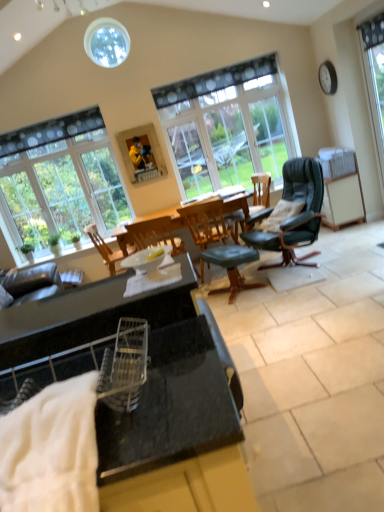
Question: Can you confirm if clear glass window at upper left, the third window in the front-to-back sequence, is thinner than clear glass window at right, which appears as the first window when viewed from the right?

Choices:
 (A) no
 (B) yes

Answer: (A)

Question: Does clear glass window at upper left, which ranks as the 3th window in right-to-left order, turn towards clear glass window at right, acting as the first window starting from the front?

Choices:
 (A) yes
 (B) no

Answer: (B)

Question: From a real-world perspective, is clear glass window at upper left, which ranks as the 3th window in right-to-left order, on top of clear glass window at right, the 3th window positioned from the left?

Choices:
 (A) no
 (B) yes

Answer: (B)

Question: Is clear glass window at right, which appears as the first window when viewed from the right, located within clear glass window at upper left, positioned as the 1th window in back-to-front order?

Choices:
 (A) no
 (B) yes

Answer: (A)

Question: From the image's perspective, would you say clear glass window at upper left, which ranks as the 3th window in right-to-left order, is positioned over clear glass window at right, which appears as the first window when viewed from the right?

Choices:
 (A) yes
 (B) no

Answer: (B)

Question: Is clear glass window at upper left, marked as the first window in a left-to-right arrangement, in contact with clear glass window at right, acting as the first window starting from the front?

Choices:
 (A) yes
 (B) no

Answer: (B)

Question: Could you tell me if black granite cabinet at center is turned towards green leafy plant at left?

Choices:
 (A) yes
 (B) no

Answer: (B)

Question: Does black granite cabinet at center appear on the right side of green leafy plant at left?

Choices:
 (A) no
 (B) yes

Answer: (B)

Question: Is green leafy plant at left at the back of black granite cabinet at center?

Choices:
 (A) yes
 (B) no

Answer: (A)

Question: Is green leafy plant at left inside black granite cabinet at center?

Choices:
 (A) no
 (B) yes

Answer: (A)

Question: Considering the relative sizes of black granite cabinet at center and green leafy plant at left in the image provided, is black granite cabinet at center smaller than green leafy plant at left?

Choices:
 (A) no
 (B) yes

Answer: (A)

Question: Is black granite cabinet at center bigger than green leafy plant at left?

Choices:
 (A) yes
 (B) no

Answer: (A)

Question: From a real-world perspective, is black granite cabinet at center located higher than green leather chair at center, the 2th chair from the right?

Choices:
 (A) no
 (B) yes

Answer: (B)